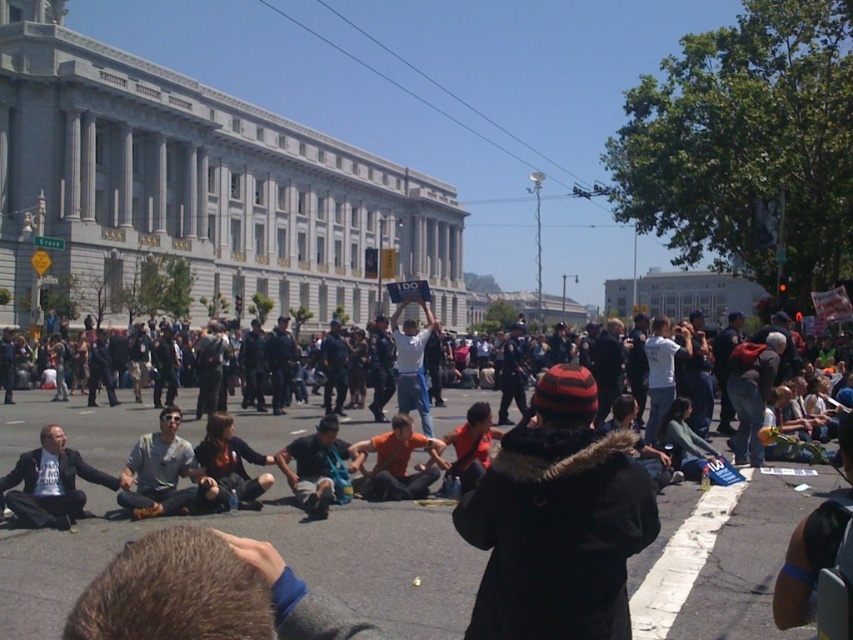
You are a photographer standing in front of the large classical building. You notice two people at the center of the scene wearing dark blue jeans at center and white cotton shirt at center. Which piece of clothing is positioned to the left?

The dark blue jeans at center is to the left of white cotton shirt at center, so the dark blue jeans at center is positioned to the left.